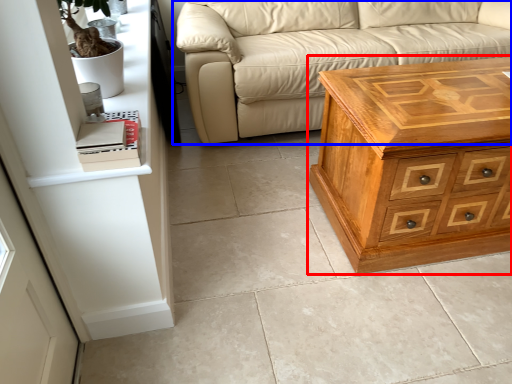
Question: Which object is further to the camera taking this photo, chest of drawers (highlighted by a red box) or studio couch (highlighted by a blue box)?

Choices:
 (A) chest of drawers
 (B) studio couch

Answer: (B)